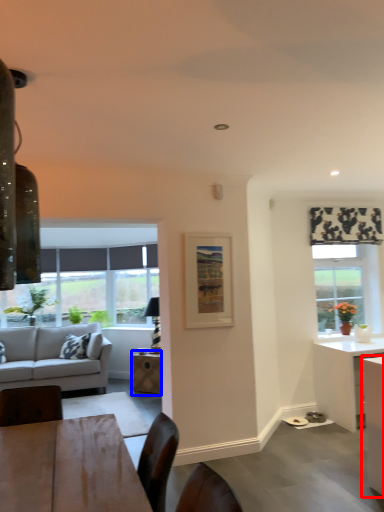
Question: Which object is closer to the camera taking this photo, cabinetry (highlighted by a red box) or table (highlighted by a blue box)?

Choices:
 (A) cabinetry
 (B) table

Answer: (A)